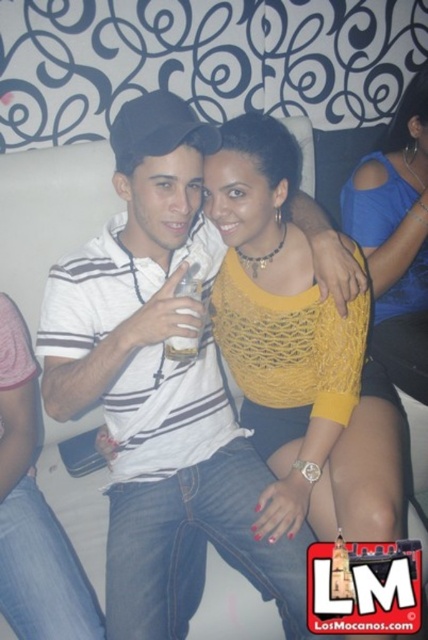
In the scene shown: You are a photographer standing at the back of the bar. You want to take a closeup photo of the white striped shirt at center. The camera you are using has a minimum focusing distance of 36 inches. Can you take the photo without moving closer?

The distance of white striped shirt at center from camera is 39.01 inches. Since the minimum focusing distance is 36 inches, the photographer can take the closeup photo without moving closer as the subject is within range.

You are a photographer trying to capture a candid shot of the yellow knitted top at center and the blue mesh top at upper right. To ensure both are in frame, should you adjust your camera to focus more to the left or the right?

The yellow knitted top at center is to the left of the blue mesh top at upper right, so you should focus more to the left to include both in the frame.